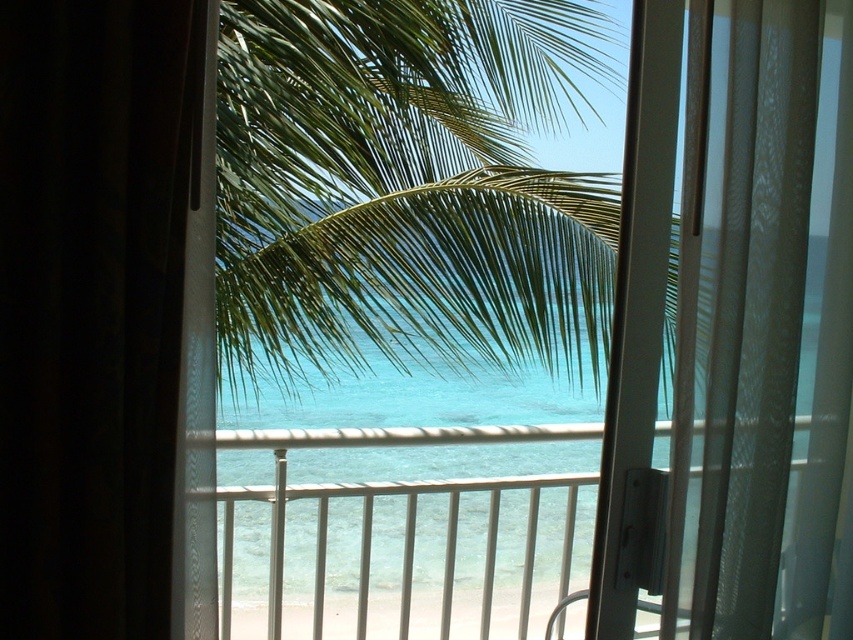
You are standing inside the room looking through the glass door. There are two points marked on the glass door. One is at coordinate point (375, 292) and the other is at point (74, 170). Which point is closer to you as you face the door?

Point (74, 170) is closer to you because it is in front of point (375, 292) when facing the door.

You are planning to hang a large painting on the wall behind the green leafy palm tree at center and the black sheer curtain at left. Which object would you need to consider the size of the painting relative to?

The green leafy palm tree at center is larger in size than the black sheer curtain at left, so you should consider the size of the painting relative to the green leafy palm tree at center to ensure proper placement.

You are a visitor staying in this room and want to know if the green leafy palm tree at center is taller than the black sheer curtain at left when viewed from the balcony. Can you confirm?

The green leafy palm tree at center is taller than the black sheer curtain at left, so yes, it is taller when viewed from the balcony.